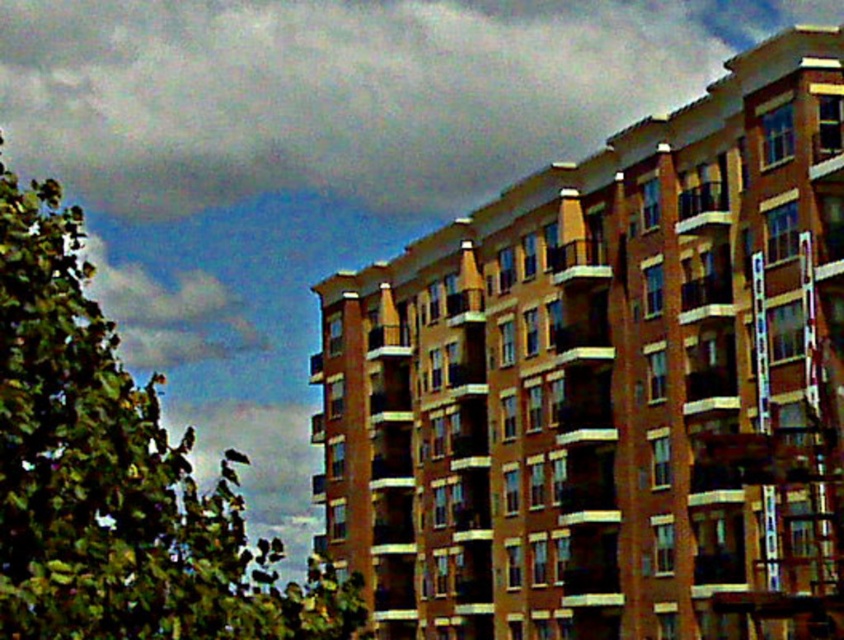
Does gray fluffy cloud at upper left appear over green leafy tree at left?

Correct, gray fluffy cloud at upper left is located above green leafy tree at left.

Does gray fluffy cloud at upper left come in front of green leafy tree at left?

No, gray fluffy cloud at upper left is further to the viewer.

Locate an element on the screen. gray fluffy cloud at upper left is located at coordinates (333, 93).

What do you see at coordinates (333, 93) in the screenshot? I see `gray fluffy cloud at upper left` at bounding box center [333, 93].

Can you confirm if gray fluffy cloud at upper left is smaller than white fluffy cloud at upper left?

No, gray fluffy cloud at upper left is not smaller than white fluffy cloud at upper left.

Find the location of a particular element. gray fluffy cloud at upper left is located at coordinates (333, 93).

Does green leafy tree at left appear under white fluffy cloud at upper left?

Yes.

Can you confirm if green leafy tree at left is wider than white fluffy cloud at upper left?

Yes.

The height and width of the screenshot is (640, 844). Identify the location of green leafy tree at left. (117, 476).